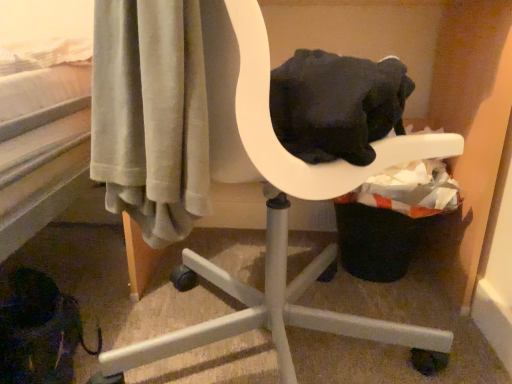
Question: Relative to black fabric laundry basket at lower right, is white plastic chair at center in front or behind?

Choices:
 (A) behind
 (B) front

Answer: (B)

Question: Looking at the image, does white plastic chair at center seem bigger or smaller compared to black fabric laundry basket at lower right?

Choices:
 (A) big
 (B) small

Answer: (A)

Question: In terms of width, does white plastic chair at center look wider or thinner when compared to black fabric laundry basket at lower right?

Choices:
 (A) wide
 (B) thin

Answer: (A)

Question: Is point (401, 256) positioned closer to the camera than point (320, 324)?

Choices:
 (A) closer
 (B) farther

Answer: (B)

Question: From a real-world perspective, is black fabric laundry basket at lower right above or below white plastic chair at center?

Choices:
 (A) above
 (B) below

Answer: (B)

Question: Is black fabric laundry basket at lower right bigger or smaller than white plastic chair at center?

Choices:
 (A) small
 (B) big

Answer: (A)

Question: Relative to white plastic chair at center, is black fabric laundry basket at lower right in front or behind?

Choices:
 (A) behind
 (B) front

Answer: (A)